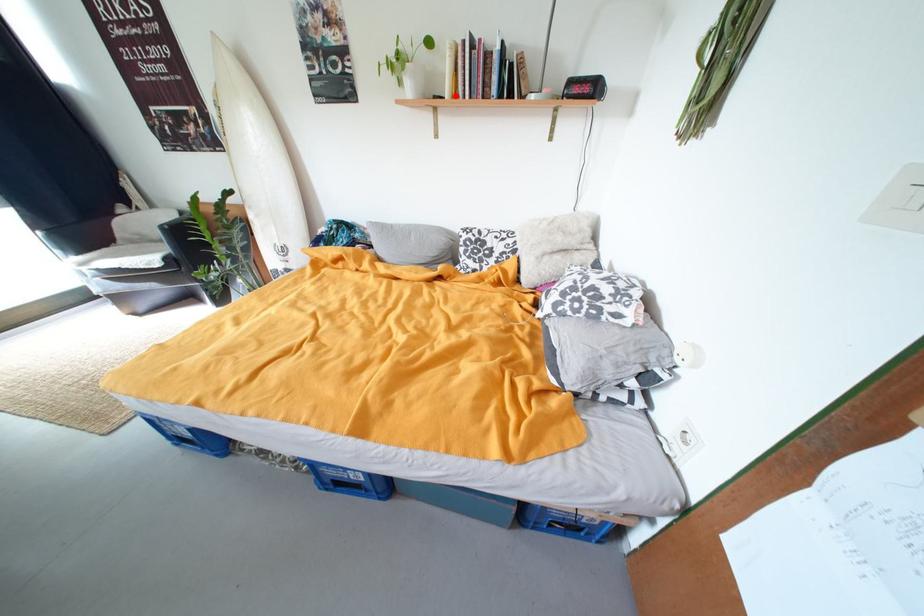
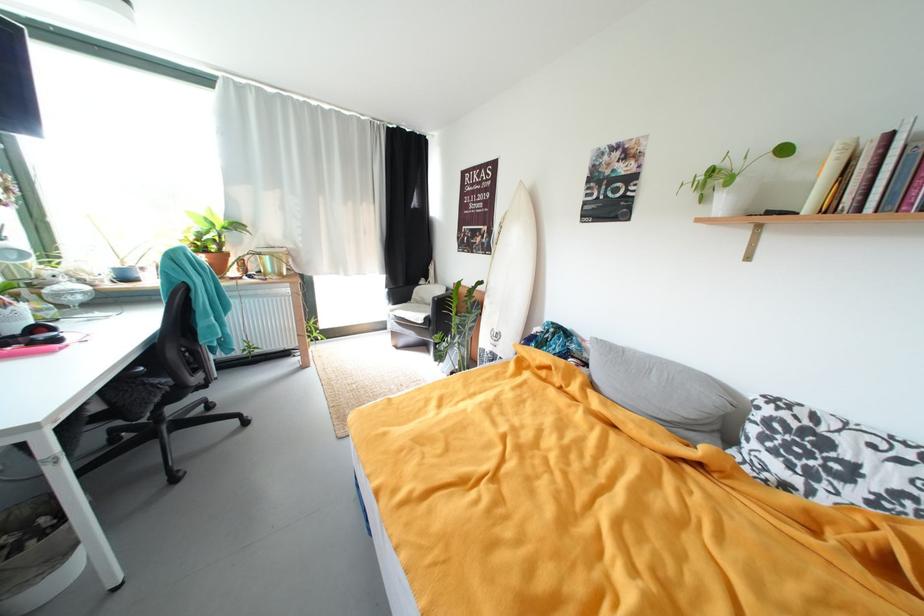
Question: I am providing you with two images of the same scene from different viewpoints. A red point is marked on the first image. Can you still see the location of the red point in image 2?

Choices:
 (A) Yes
 (B) No

Answer: (A)